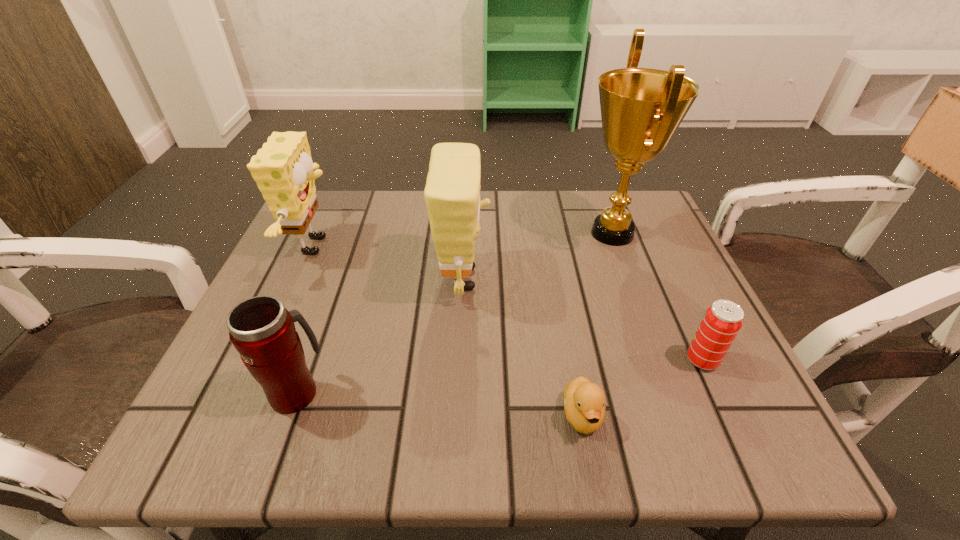
Where is `vacant space at the right edge of the desktop`? vacant space at the right edge of the desktop is located at coordinates [x=660, y=266].

Find the location of a particular element. free space at the far left corner of the desktop is located at coordinates (335, 234).

Locate an element on the screen. free area in between the third shortest object and the soda can is located at coordinates (499, 376).

Where is `vacant area that lies between the thermos bottle and the left sponge`? The image size is (960, 540). vacant area that lies between the thermos bottle and the left sponge is located at coordinates (307, 319).

This screenshot has height=540, width=960. In order to click on vacant space that's between the second shortest object and the thermos bottle in this screenshot , I will do `click(499, 376)`.

Where is `vacant space that is in between the right sponge and the left sponge`? This screenshot has width=960, height=540. vacant space that is in between the right sponge and the left sponge is located at coordinates (391, 262).

The width and height of the screenshot is (960, 540). What are the coordinates of `empty location between the left sponge and the third shortest object` in the screenshot? It's located at (307, 319).

Find the location of a particular element. Image resolution: width=960 pixels, height=540 pixels. free space between the second shortest object and the right sponge is located at coordinates (583, 320).

Identify the location of free space between the left sponge and the fifth tallest object. (510, 303).

At what (x,y) coordinates should I click in order to perform the action: click on vacant space that's between the thermos bottle and the fourth object from left to right. Please return your answer as a coordinate pair (x, y). The width and height of the screenshot is (960, 540). Looking at the image, I should click on coord(440,403).